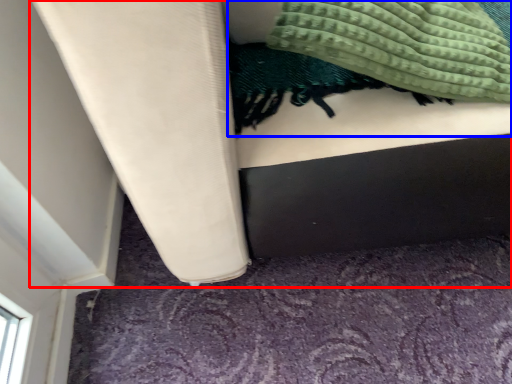
Question: Which object is further to the camera taking this photo, furniture (highlighted by a red box) or blanket (highlighted by a blue box)?

Choices:
 (A) furniture
 (B) blanket

Answer: (B)